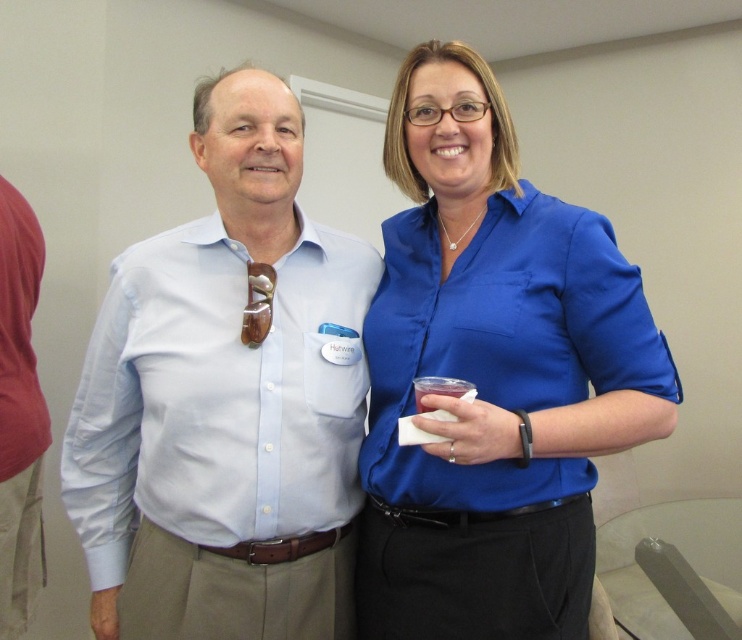
You are at a networking event and see two people in blue shirts. The blue satin blouse at center and the light blue cotton shirt at center. Which one is positioned to the right?

The blue satin blouse at center is positioned to the right of the light blue cotton shirt at center.

You are a fashion designer observing the two individuals at a professional event. You need to determine which clothing item is taller when viewed from the front. Which one is taller between the blue satin blouse at center and the light blue cotton shirt at center?

The blue satin blouse at center is taller compared to the light blue cotton shirt at center.

In the scene shown: You are attending a networking event and want to approach the person wearing the blue satin blouse at center and the light blue cotton shirt at center. Which one should you walk towards first to greet them?

You should walk towards the blue satin blouse at center first because it is closer to you than the light blue cotton shirt at center.